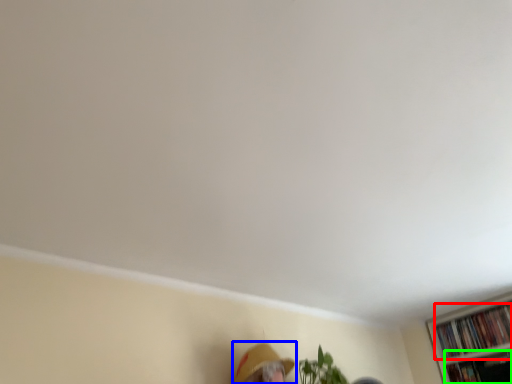
Question: Considering the real-world distances, which object is farthest from book (highlighted by a red box)? person (highlighted by a blue box) or book (highlighted by a green box)?

Choices:
 (A) person
 (B) book

Answer: (A)